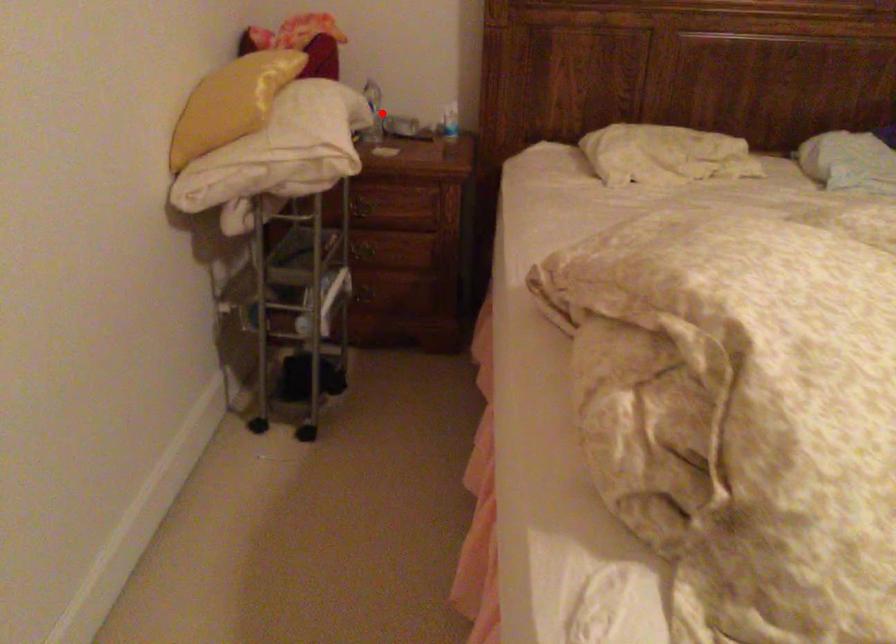
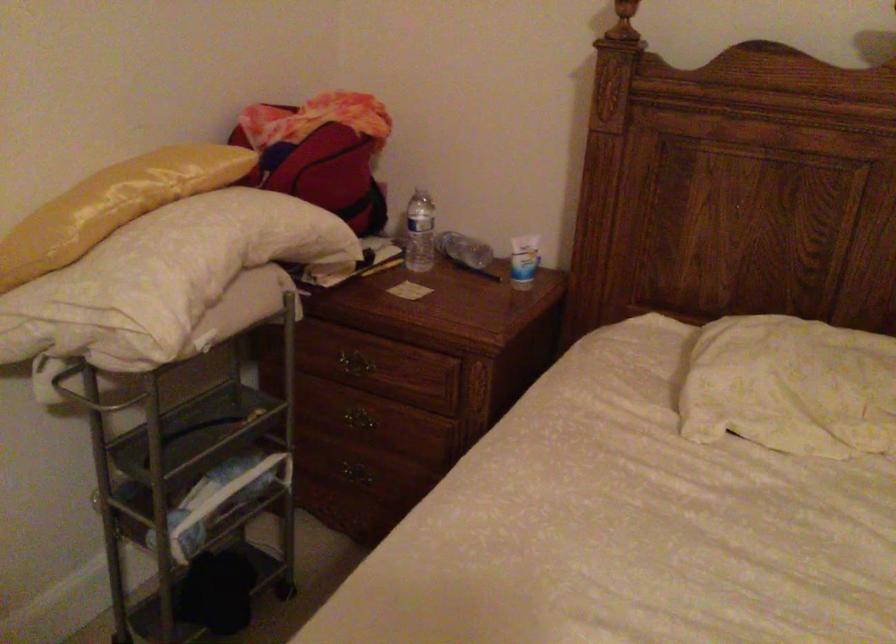
Where in the second image is the point corresponding to the highlighted location from the first image?

(419, 232)